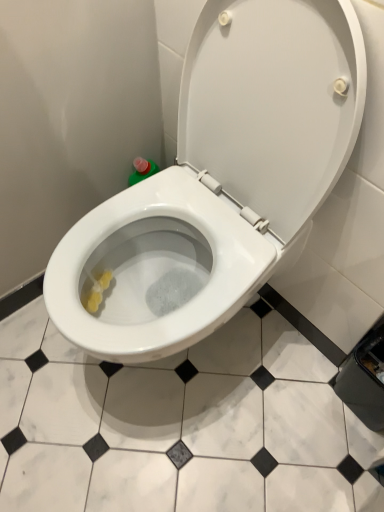
The height and width of the screenshot is (512, 384). I want to click on white glossy toilet at center, so coord(229,169).

This screenshot has height=512, width=384. What do you see at coordinates (229, 169) in the screenshot?
I see `white glossy toilet at center` at bounding box center [229, 169].

Measure the distance between point [291,218] and camera.

Point [291,218] is 31.69 inches away from camera.

Identify the location of white glossy toilet at center. (229, 169).